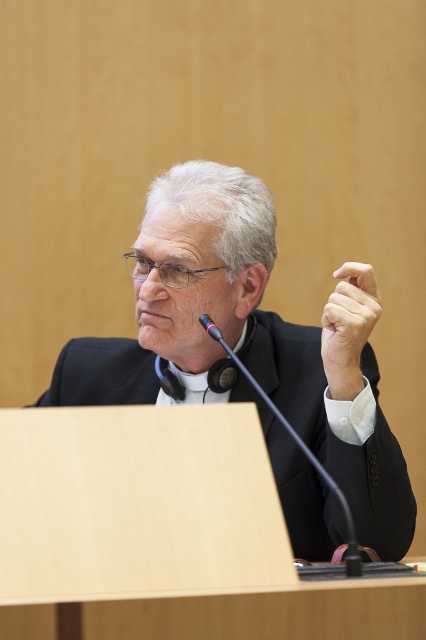
You are a photographer positioned behind the man at the podium. You want to focus your camera on the smooth skin hand at center without the black matte suit at center blocking the view. Is this possible given their positions?

The black matte suit at center is further to the viewer than the smooth skin hand at center, so the black matte suit at center would block the view of the smooth skin hand at center. Therefore, it is not possible to focus on the smooth skin hand at center without the black matte suit at center blocking the view.